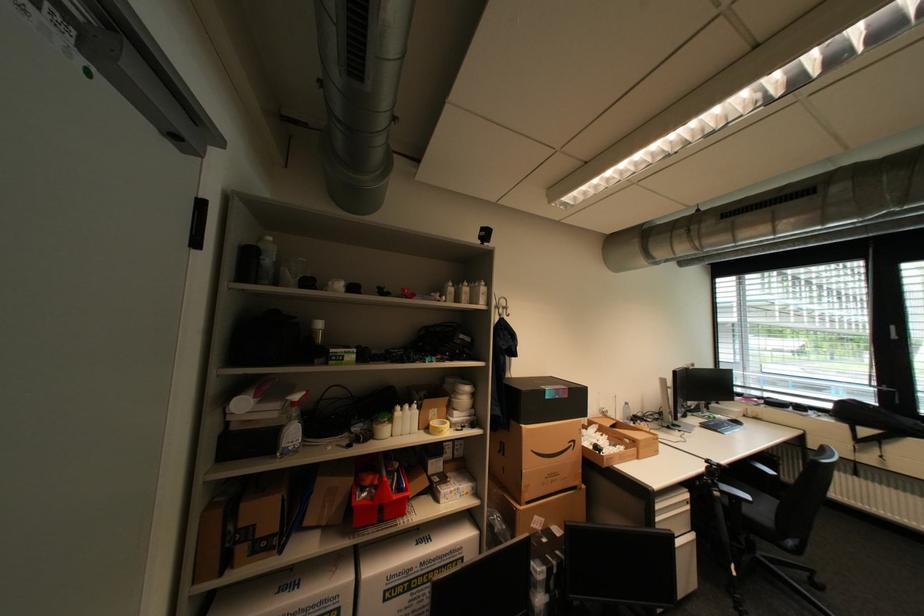
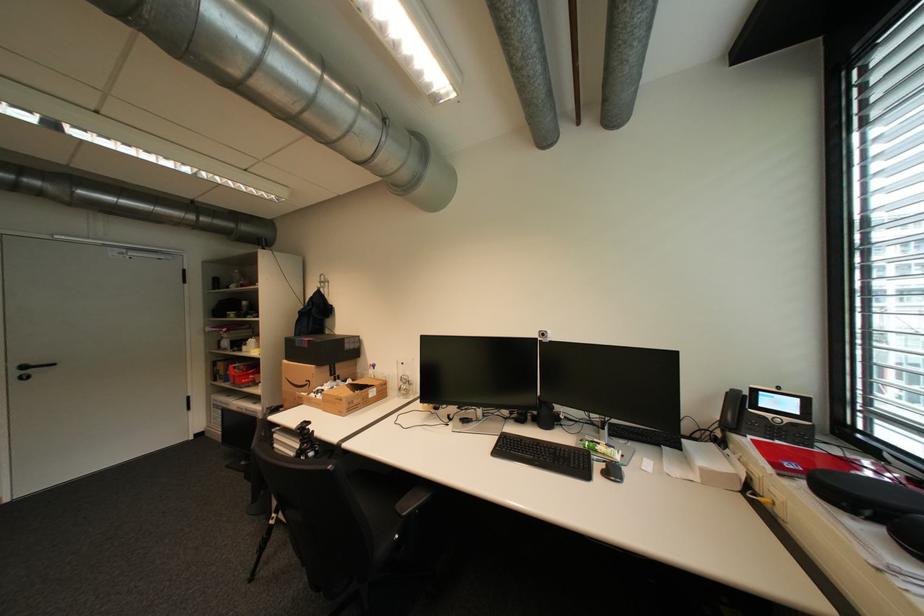
Find the pixel in the second image that matches (x=580, y=444) in the first image.

(317, 383)